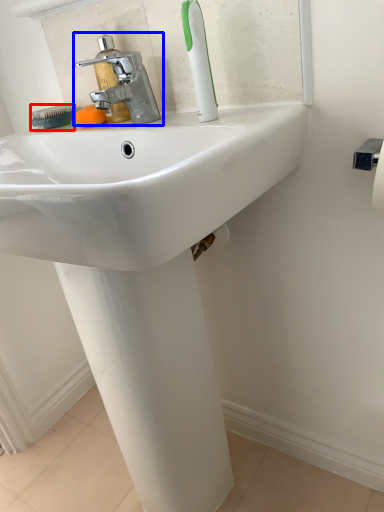
Question: Among these objects, which one is nearest to the camera, brush (highlighted by a red box) or tap (highlighted by a blue box)?

Choices:
 (A) brush
 (B) tap

Answer: (B)